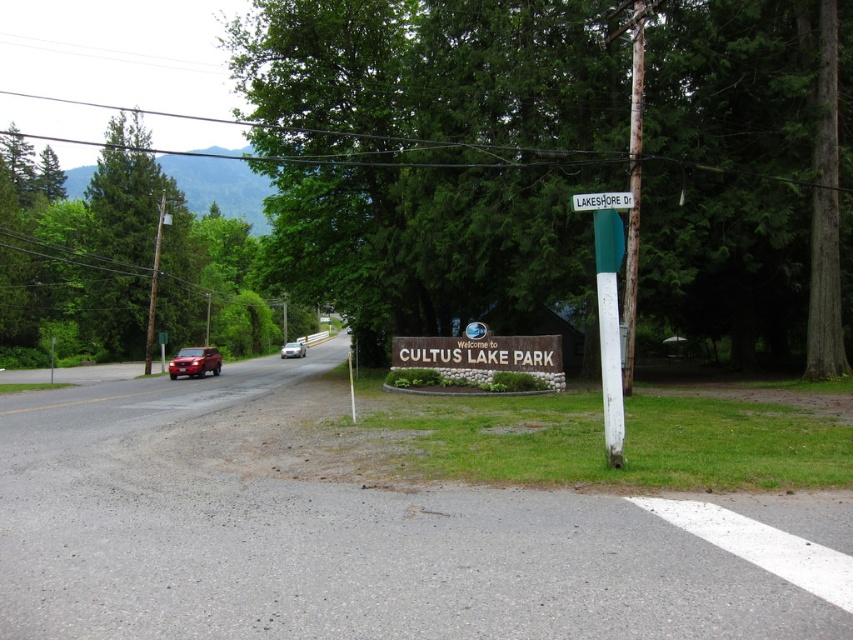
Between point (607, 392) and point (456, 368), which one is positioned in front?

Positioned in front is point (607, 392).

Locate an element on the screen. green plastic signpost at center-right is located at coordinates (608, 307).

Is point (573, 196) more distant than point (282, 346)?

No, it is not.

Who is more distant from viewer, [601,208] or [282,356]?

Positioned behind is point [282,356].

Describe the element at coordinates (601, 200) in the screenshot. I see `white plastic street sign at upper center` at that location.

This screenshot has height=640, width=853. I want to click on white plastic street sign at upper center, so click(601, 200).

Which is below, matte red suv at left or white plastic street sign at upper center?

matte red suv at left is below.

Can you confirm if matte red suv at left is wider than white plastic street sign at upper center?

Correct, the width of matte red suv at left exceeds that of white plastic street sign at upper center.

Image resolution: width=853 pixels, height=640 pixels. In order to click on matte red suv at left in this screenshot , I will do `click(195, 362)`.